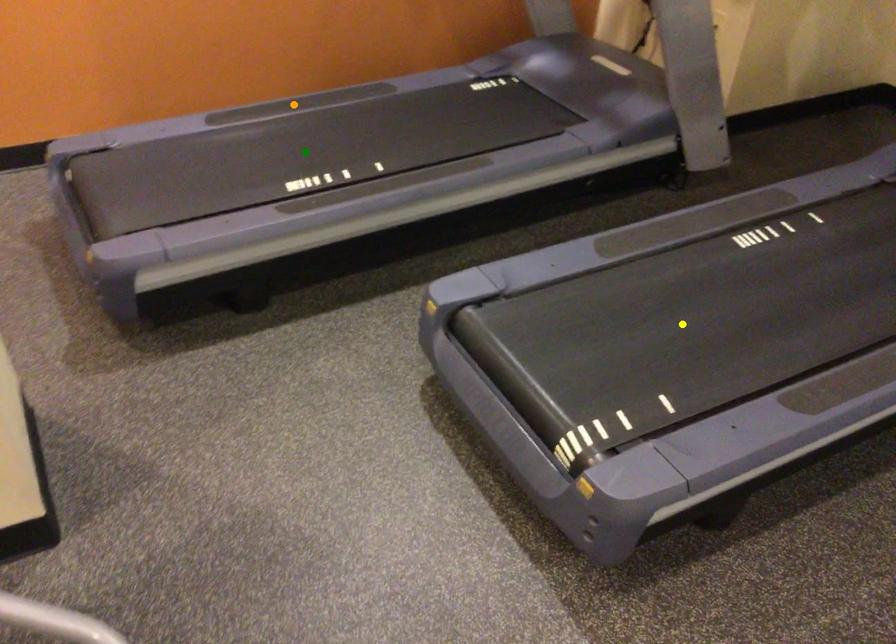
Order these from nearest to farthest:
yellow point
orange point
green point

orange point → green point → yellow point